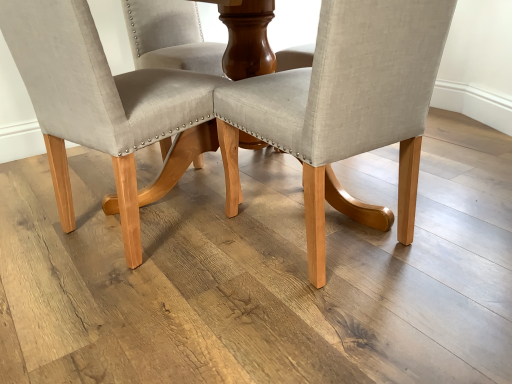
The width and height of the screenshot is (512, 384). I want to click on free space in front of beige fabric chair at center, which appears as the first chair when viewed from the left, so click(146, 306).